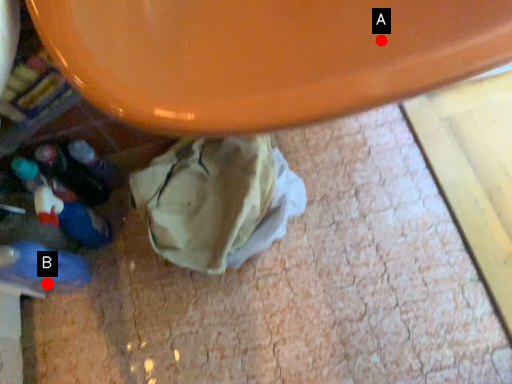
Question: Two points are circled on the image, labeled by A and B beside each circle. Which point appears farthest from the camera in this image?

Choices:
 (A) A is further
 (B) B is further

Answer: (B)